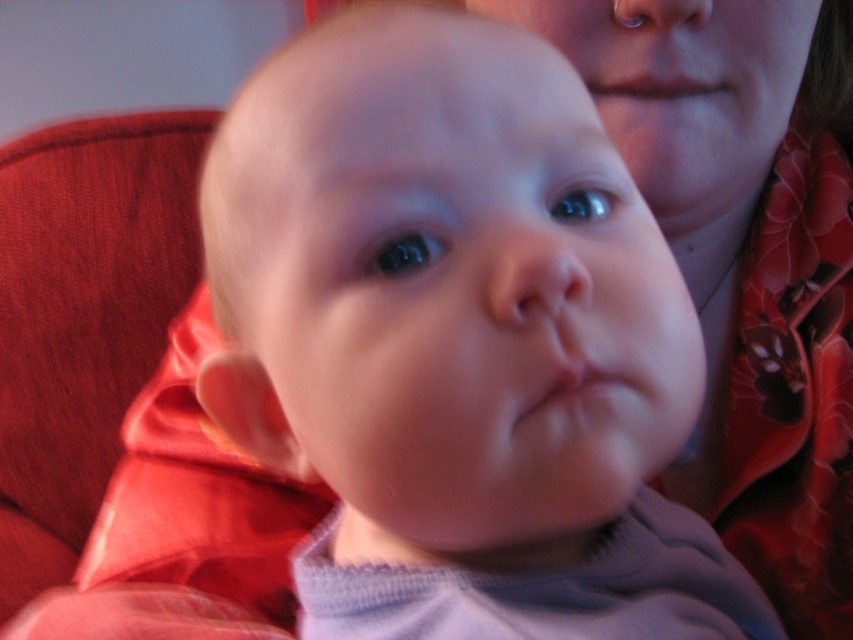
Is smooth flesh nose at center in front of pink smooth lips at center?

That is True.

Is smooth flesh nose at center taller than pink smooth lips at center?

In fact, smooth flesh nose at center may be shorter than pink smooth lips at center.

Is point (575, 253) more distant than point (660, 403)?

No, it is not.

Locate an element on the screen. The height and width of the screenshot is (640, 853). smooth flesh nose at center is located at coordinates point(532,276).

Who is more forward, (747, 154) or (612, 364)?

Point (612, 364) is more forward.

Describe the element at coordinates (683, 93) in the screenshot. I see `smooth skin face at upper center` at that location.

Is point (753, 131) positioned behind point (583, 390)?

Yes, it is.

At what (x,y) coordinates should I click in order to perform the action: click on smooth skin face at upper center. Please return your answer as a coordinate pair (x, y). This screenshot has height=640, width=853. Looking at the image, I should click on (683, 93).

In order to click on smooth flesh nose at center in this screenshot , I will do `click(532, 276)`.

Does point (486, 308) come farther from viewer compared to point (703, 13)?

No.

Is point (527, 248) farther from camera compared to point (695, 8)?

No, it is in front of (695, 8).

The image size is (853, 640). Find the location of `smooth flesh nose at center`. smooth flesh nose at center is located at coordinates (532, 276).